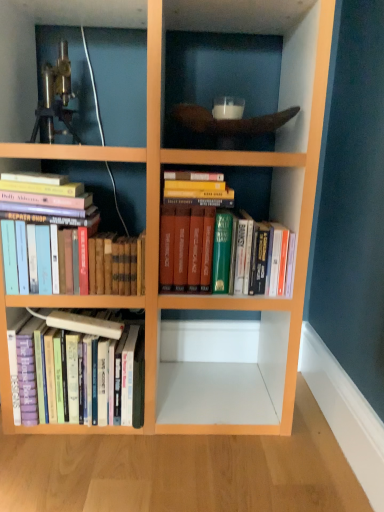
Question: From a real-world perspective, is hardcover books at lower left, which appears as the first book when viewed from the left, physically above metallic tripod at upper left?

Choices:
 (A) no
 (B) yes

Answer: (A)

Question: Is hardcover books at lower left, which ranks as the third book in right-to-left order, looking in the opposite direction of metallic tripod at upper left?

Choices:
 (A) yes
 (B) no

Answer: (B)

Question: From the image's perspective, does hardcover books at lower left, which appears as the first book when viewed from the left, appear higher than metallic tripod at upper left?

Choices:
 (A) yes
 (B) no

Answer: (B)

Question: Can you confirm if hardcover books at lower left, which appears as the first book when viewed from the left, is positioned to the left of metallic tripod at upper left?

Choices:
 (A) yes
 (B) no

Answer: (B)

Question: Does hardcover books at lower left, which appears as the first book when viewed from the left, come in front of metallic tripod at upper left?

Choices:
 (A) yes
 (B) no

Answer: (B)

Question: From a real-world perspective, is hardcover books at left, the 2th book positioned from the right, above or below metallic tripod at upper left?

Choices:
 (A) below
 (B) above

Answer: (A)

Question: Is hardcover books at left, the 2th book positioned from the right, to the left or to the right of metallic tripod at upper left in the image?

Choices:
 (A) right
 (B) left

Answer: (A)

Question: Looking at the image, does hardcover books at left, the 2th book positioned from the right, seem bigger or smaller compared to metallic tripod at upper left?

Choices:
 (A) big
 (B) small

Answer: (A)

Question: Is hardcover books at left, the 2th book positioned from the right, in front of or behind metallic tripod at upper left in the image?

Choices:
 (A) behind
 (B) front

Answer: (B)

Question: Based on their sizes in the image, would you say metallic tripod at upper left is bigger or smaller than hardcover books at lower left, which appears as the first book when viewed from the left?

Choices:
 (A) small
 (B) big

Answer: (A)

Question: In the image, is metallic tripod at upper left on the left side or the right side of hardcover books at lower left, which ranks as the third book in right-to-left order?

Choices:
 (A) right
 (B) left

Answer: (B)

Question: Choose the correct answer: Is metallic tripod at upper left inside hardcover books at lower left, which ranks as the third book in right-to-left order, or outside it?

Choices:
 (A) outside
 (B) inside

Answer: (A)

Question: From the image's perspective, relative to hardcover books at lower left, which ranks as the third book in right-to-left order, is metallic tripod at upper left above or below?

Choices:
 (A) above
 (B) below

Answer: (A)

Question: From a real-world perspective, relative to hardcover books at center, which is the 3th book from left to right, is hardcover books at left, which is counted as the second book, starting from the left, vertically above or below?

Choices:
 (A) below
 (B) above

Answer: (A)

Question: Based on their sizes in the image, would you say hardcover books at left, the 2th book positioned from the right, is bigger or smaller than hardcover books at center, which is the 3th book from left to right?

Choices:
 (A) small
 (B) big

Answer: (A)